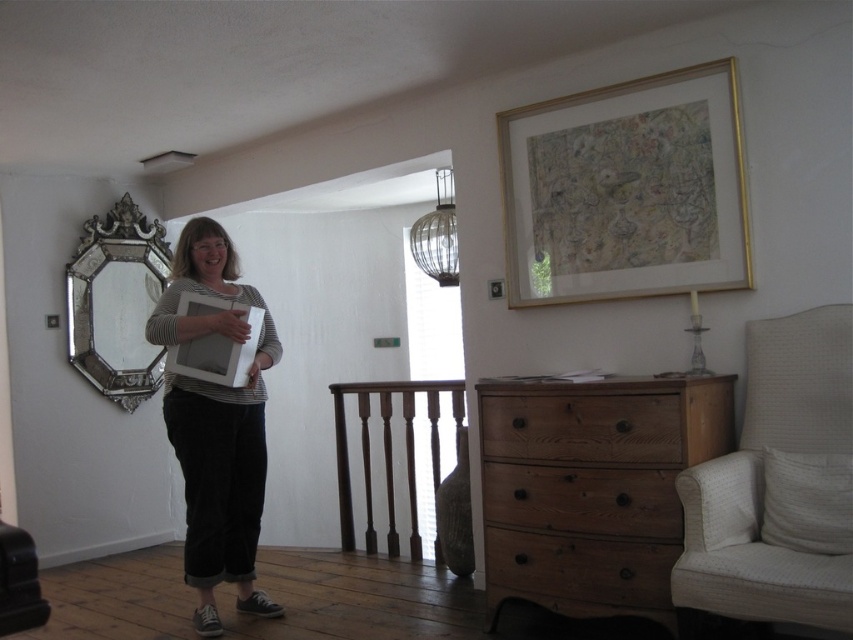
Question: Which object is farther from the camera taking this photo?

Choices:
 (A) white fabric armchair at right
 (B) striped cotton shirt at center

Answer: (B)

Question: Does silver ornate mirror at left appear on the left side of matte white picture frame at center?

Choices:
 (A) yes
 (B) no

Answer: (A)

Question: Which point is farther to the camera?

Choices:
 (A) brown wooden balustrade at center
 (B) wooden drawer at lower right
 (C) wooden dresser at lower right

Answer: (A)

Question: Which object is positioned closest to the gold/golden picture frame at upper right?

Choices:
 (A) wooden dresser at lower right
 (B) wooden drawer at lower right
 (C) matte white picture frame at center

Answer: (A)

Question: Does wooden drawer at center have a larger size compared to brown wooden balustrade at center?

Choices:
 (A) no
 (B) yes

Answer: (A)

Question: Does striped cotton shirt at center appear under brown wooden balustrade at center?

Choices:
 (A) no
 (B) yes

Answer: (A)